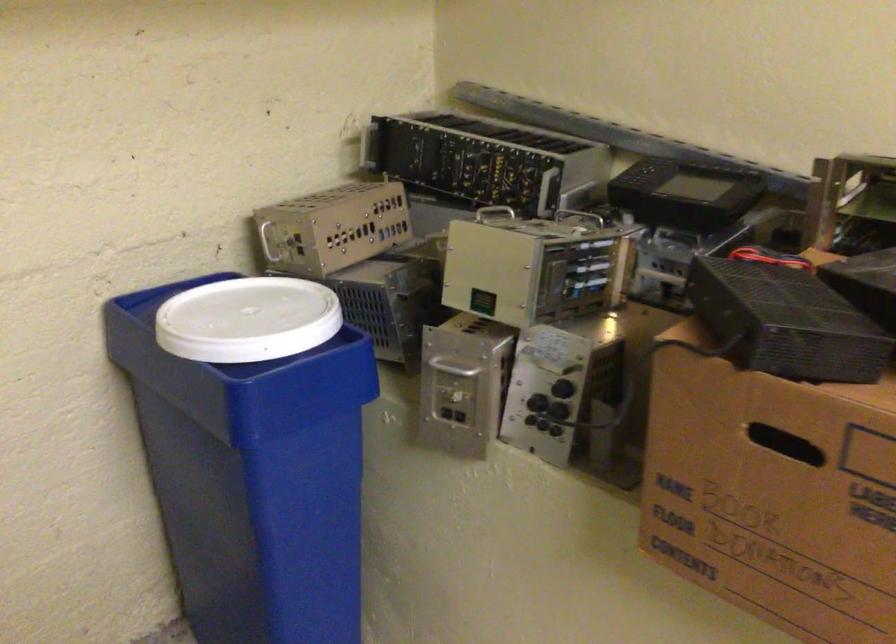
Where would you lift the box handle cutout? Please return your answer as a coordinate pair (x, y).

(785, 444)